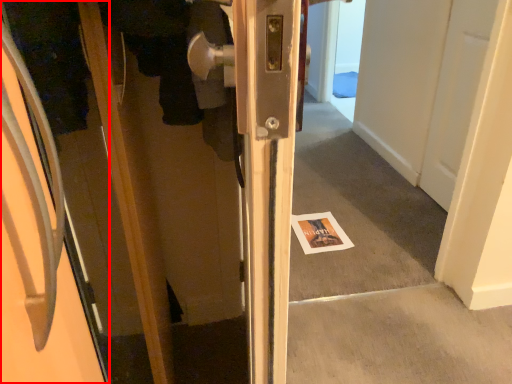
Question: Considering the relative positions of door (annotated by the red box) and magazine in the image provided, where is door (annotated by the red box) located with respect to the staircase?

Choices:
 (A) right
 (B) left

Answer: (B)